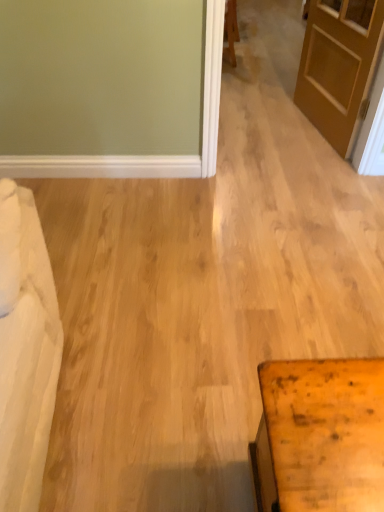
At what (x,y) coordinates should I click in order to perform the action: click on matte wooden door at upper right. Please return your answer as a coordinate pair (x, y). The width and height of the screenshot is (384, 512). Looking at the image, I should click on (339, 67).

Image resolution: width=384 pixels, height=512 pixels. Describe the element at coordinates (339, 67) in the screenshot. I see `matte wooden door at upper right` at that location.

Find the location of `matte wooden door at upper right`. matte wooden door at upper right is located at coordinates (339, 67).